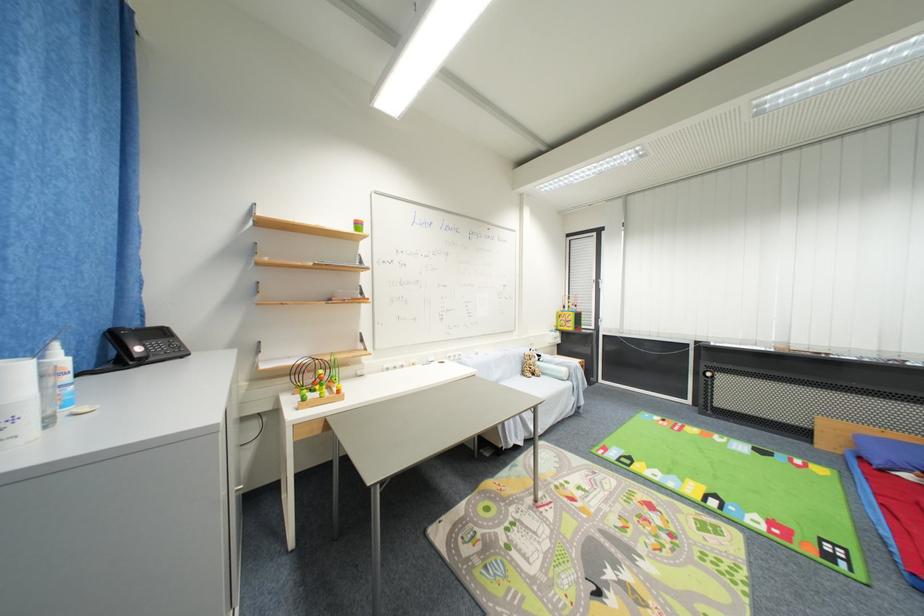
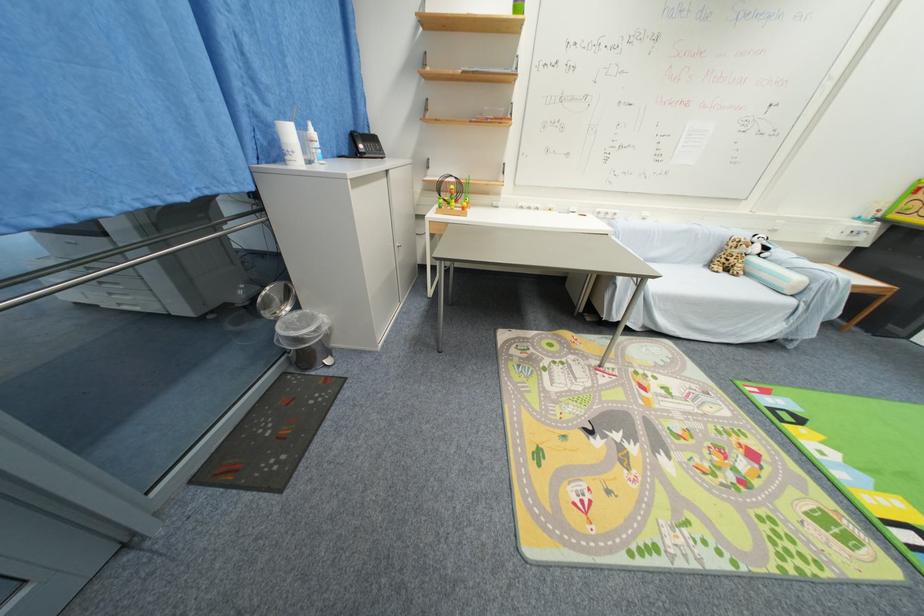
The images are taken continuously from a first-person perspective. In which direction is your viewpoint rotating?

The camera rotated toward left-down.